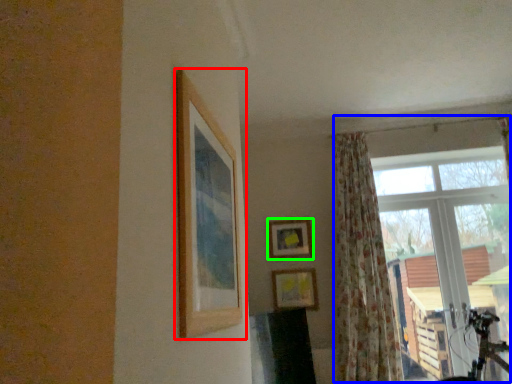
Question: Which object is the closest to the picture frame (highlighted by a red box)? Choose among these: window (highlighted by a blue box) or picture frame (highlighted by a green box).

Choices:
 (A) window
 (B) picture frame

Answer: (B)